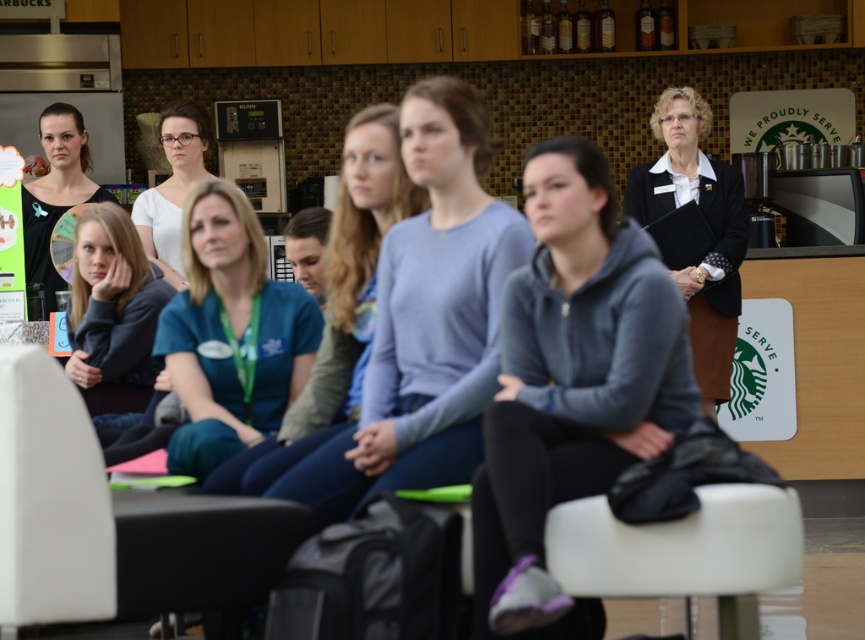
You are a barista at Starbucks who needs to place a 20 cm wide coffee cup between the gray fleece hoodie at center and the light blue sweater at center. Which side of the hoodie should you place it on to ensure it fits within the space between them?

The gray fleece hoodie at center has a lesser width compared to the light blue sweater at center, so placing the coffee cup on the side closer to the light blue sweater at center would provide enough space since the sweater is wider.